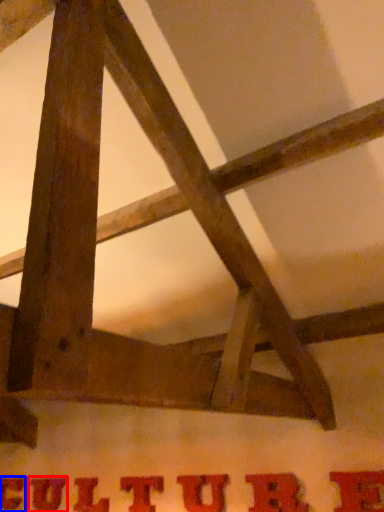
Question: Which object is closer to the camera taking this photo, letter (highlighted by a red box) or letter (highlighted by a blue box)?

Choices:
 (A) letter
 (B) letter

Answer: (A)